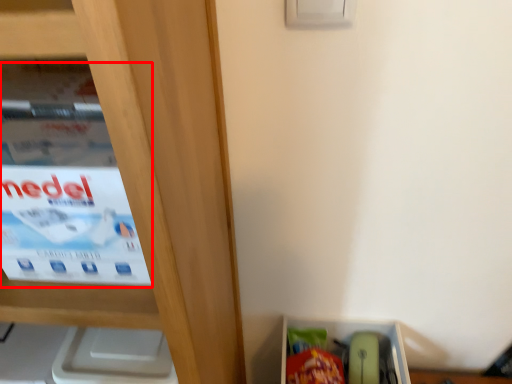
Question: In this image, where is paperback book (annotated by the red box) located relative to storage box?

Choices:
 (A) right
 (B) left

Answer: (B)